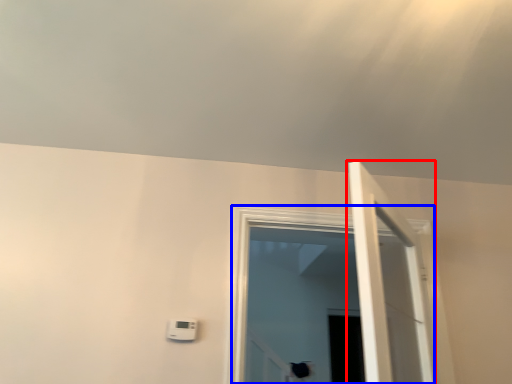
Question: Which point is further to the camera, door (highlighted by a red box) or window (highlighted by a blue box)?

Choices:
 (A) door
 (B) window

Answer: (B)